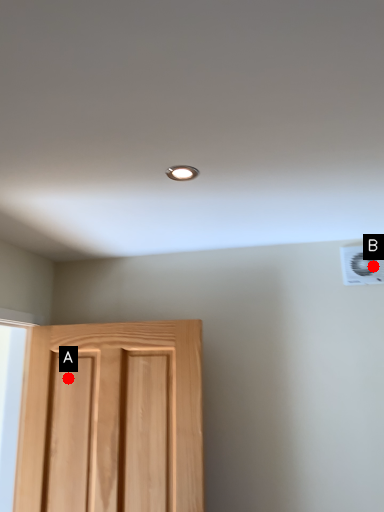
Question: Two points are circled on the image, labeled by A and B beside each circle. Which point appears farthest from the camera in this image?

Choices:
 (A) A is further
 (B) B is further

Answer: (A)